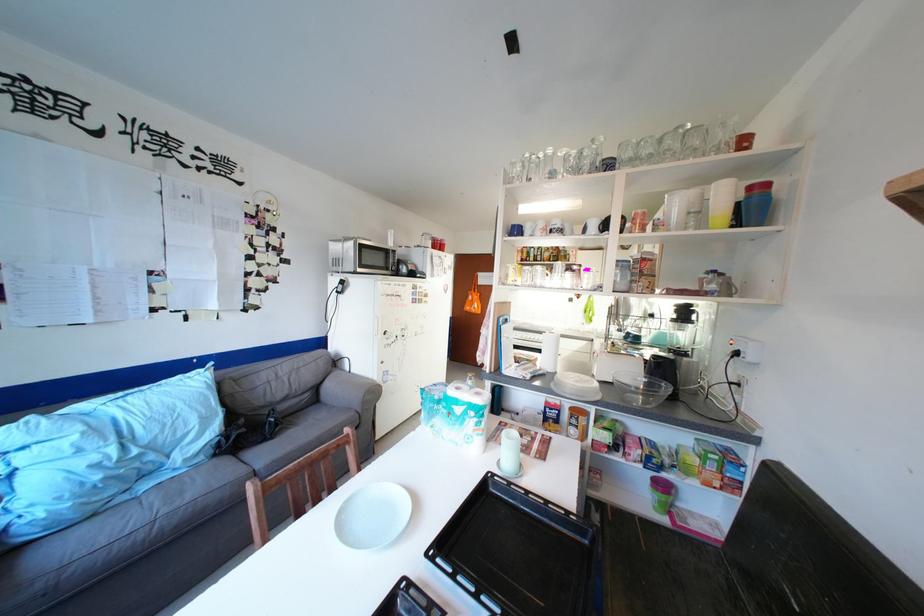
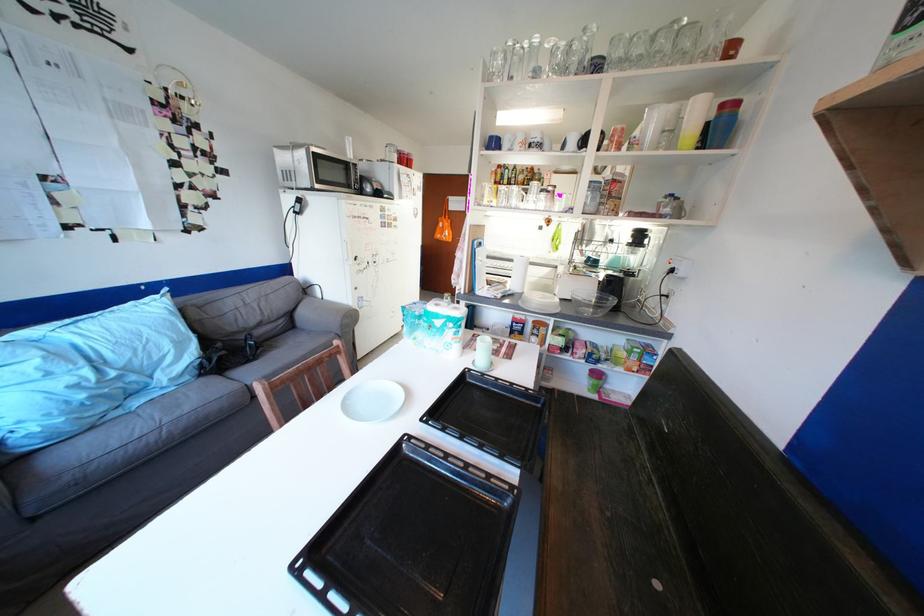
The point at [629,402] is marked in the first image. Where is the corresponding point in the second image?

(584, 314)